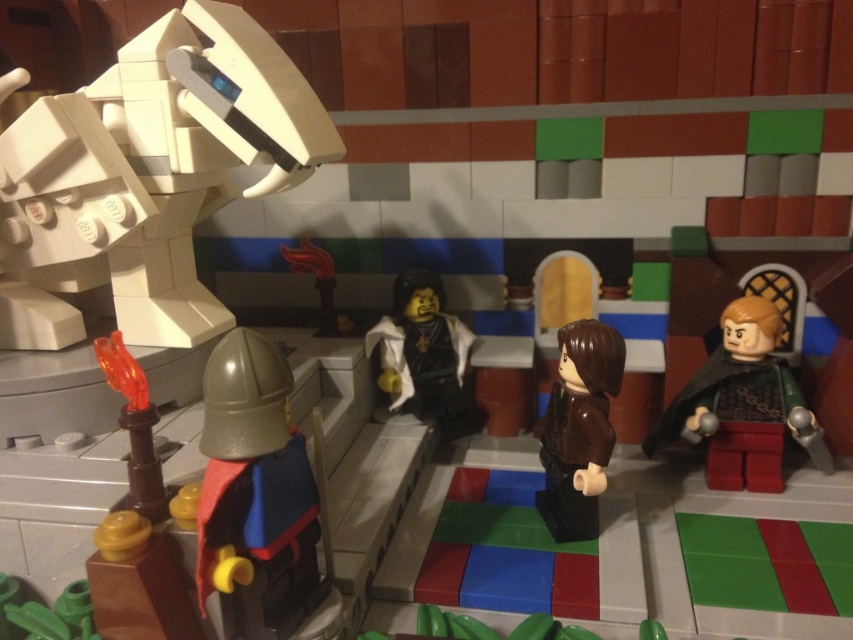
You are a LEGO minifigure standing at the camera position. You see the green metallic armor at right. Can you reach it without moving?

The green metallic armor at right is 4.16 feet away from camera, so you cannot reach it without moving since it is too far away.